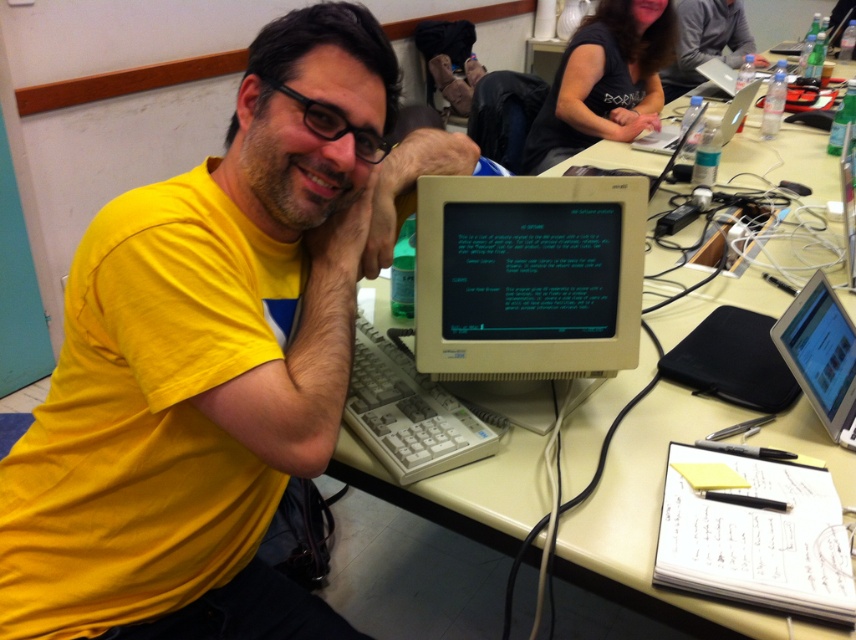
Question: Considering the real-world distances, which object is closest to the white plastic monitor at center?

Choices:
 (A) matte gray laptop at upper right
 (B) silver metallic laptop at right
 (C) white plastic table at center
 (D) yellow matte shirt at center

Answer: (D)

Question: Does yellow matte shirt at center lie in front of white plastic monitor at center?

Choices:
 (A) no
 (B) yes

Answer: (B)

Question: Among these objects, which one is farthest from the camera?

Choices:
 (A) matte gray laptop at upper right
 (B) beige matte skin at center
 (C) yellow matte shirt at center
 (D) white plastic table at center

Answer: (A)

Question: Which object is the closest to the white plastic table at center?

Choices:
 (A) yellow matte shirt at center
 (B) white plastic monitor at center
 (C) silver metallic laptop at right

Answer: (C)

Question: Is white plastic table at center smaller than white plastic monitor at center?

Choices:
 (A) no
 (B) yes

Answer: (A)

Question: Does white plastic monitor at center have a smaller size compared to beige matte skin at center?

Choices:
 (A) yes
 (B) no

Answer: (B)